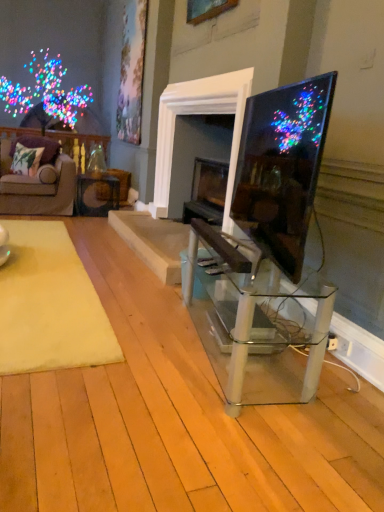
Question: Is yellow plush rug at lower left wider than matte black table at center, acting as the second table starting from the right?

Choices:
 (A) no
 (B) yes

Answer: (B)

Question: Is yellow plush rug at lower left aimed at matte black table at center, placed as the 1th table when sorted from top to bottom?

Choices:
 (A) yes
 (B) no

Answer: (B)

Question: Would you consider yellow plush rug at lower left to be distant from matte black table at center, which is the 2th table from bottom to top?

Choices:
 (A) yes
 (B) no

Answer: (A)

Question: Is yellow plush rug at lower left positioned beyond the bounds of matte black table at center, which is the 2th table from bottom to top?

Choices:
 (A) no
 (B) yes

Answer: (B)

Question: Is yellow plush rug at lower left at the left side of matte black table at center, acting as the second table starting from the right?

Choices:
 (A) yes
 (B) no

Answer: (A)

Question: From a real-world perspective, relative to yellow plush rug at lower left, is green floral fabric pillow at left vertically above or below?

Choices:
 (A) above
 (B) below

Answer: (A)

Question: Is green floral fabric pillow at left taller or shorter than yellow plush rug at lower left?

Choices:
 (A) short
 (B) tall

Answer: (B)

Question: Is green floral fabric pillow at left situated inside yellow plush rug at lower left or outside?

Choices:
 (A) inside
 (B) outside

Answer: (B)

Question: In the image, is green floral fabric pillow at left positioned in front of or behind yellow plush rug at lower left?

Choices:
 (A) front
 (B) behind

Answer: (B)

Question: Do you think velvet purple couch at left is within green floral fabric pillow at left, or outside of it?

Choices:
 (A) outside
 (B) inside

Answer: (A)

Question: Is velvet purple couch at left in front of or behind green floral fabric pillow at left in the image?

Choices:
 (A) front
 (B) behind

Answer: (A)

Question: From the image's perspective, relative to green floral fabric pillow at left, is velvet purple couch at left above or below?

Choices:
 (A) below
 (B) above

Answer: (A)

Question: From a real-world perspective, is velvet purple couch at left physically located above or below green floral fabric pillow at left?

Choices:
 (A) above
 (B) below

Answer: (B)

Question: In the image, is clear glass table at center, acting as the second table starting from the left, positioned in front of or behind green floral fabric pillow at left?

Choices:
 (A) behind
 (B) front

Answer: (B)

Question: Considering the positions of point (281, 394) and point (21, 164), is point (281, 394) closer or farther from the camera than point (21, 164)?

Choices:
 (A) farther
 (B) closer

Answer: (B)